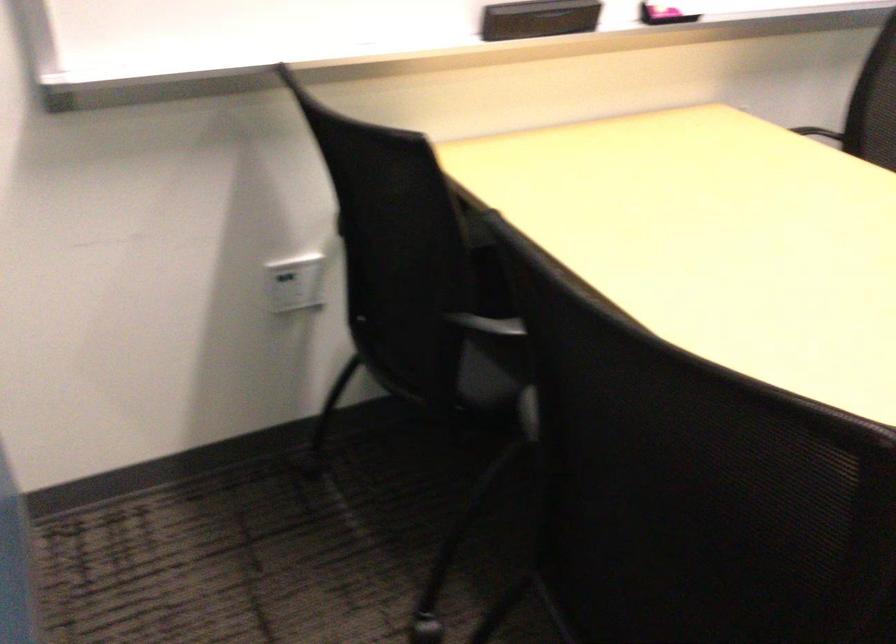
Locate an element on the screen. chair sitting surface is located at coordinates (493, 354).